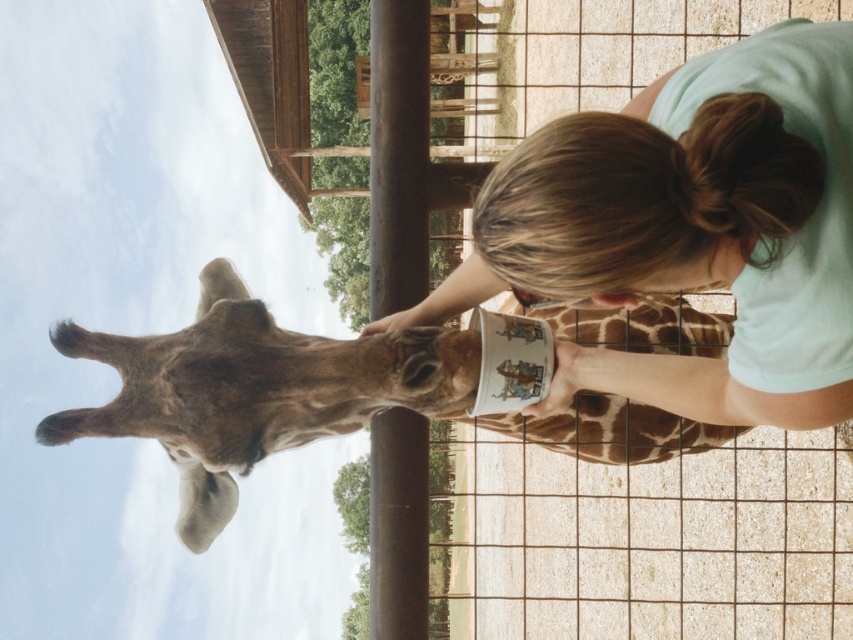
How far apart are light blue t-shirt at center and brown spotted giraffe at center?

A distance of 11.16 feet exists between light blue t-shirt at center and brown spotted giraffe at center.

Consider the image. Is light blue t-shirt at center bigger than brown spotted giraffe at center?

Yes.

The image size is (853, 640). In order to click on light blue t-shirt at center in this screenshot , I will do `click(691, 228)`.